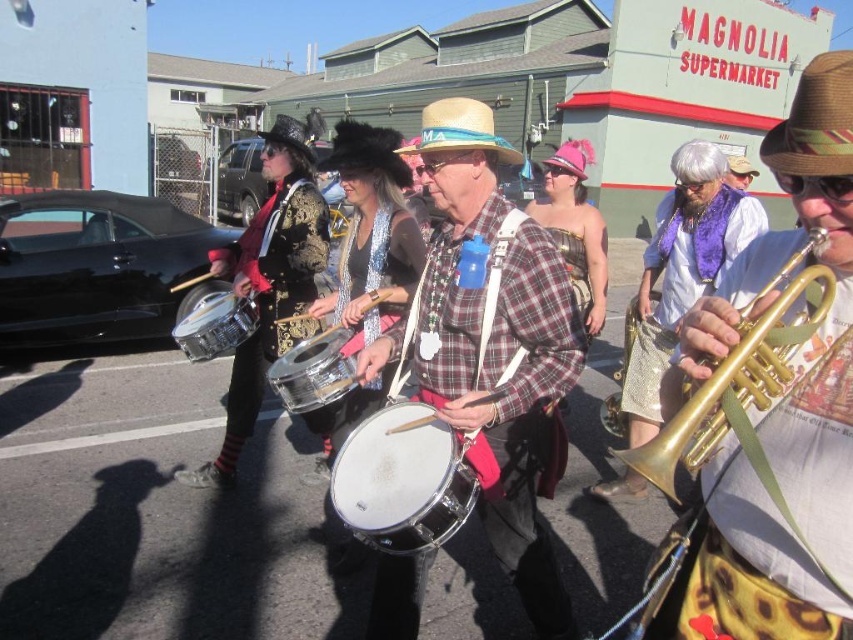
Question: Which is farther from the silver metallic drum at center?

Choices:
 (A) metallic silver drum at center
 (B) black fur cowboy hat at center
 (C) brown woven cowboy hat at upper right
 (D) brushed metal drum at center

Answer: (D)

Question: Can you confirm if brushed metal drum at left is positioned to the left of shiny silver drum at center?

Choices:
 (A) yes
 (B) no

Answer: (A)

Question: Which of the following is the closest to the observer?

Choices:
 (A) metallic silver drum at center
 (B) brown felt cowboy hat at upper center
 (C) brown woven cowboy hat at upper right
 (D) straw hat at center

Answer: (A)

Question: Is brushed metal drum at left thinner than shiny silver drum at center?

Choices:
 (A) yes
 (B) no

Answer: (B)

Question: Is brushed metal drum at center to the right of black sequined cowboy hat at upper center from the viewer's perspective?

Choices:
 (A) yes
 (B) no

Answer: (A)

Question: Which of the following is the closest to the observer?

Choices:
 (A) gold brass trumpet at right
 (B) brown felt cowboy hat at upper center
 (C) metallic silver drum at center
 (D) black sequined cowboy hat at upper center

Answer: (A)